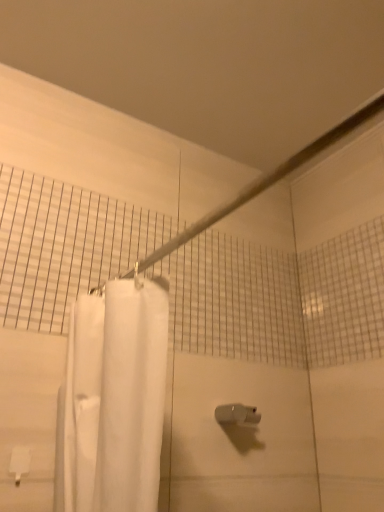
This screenshot has height=512, width=384. I want to click on satin silver towel bar at lower center, so click(x=237, y=414).

Describe the element at coordinates (237, 414) in the screenshot. I see `satin silver towel bar at lower center` at that location.

This screenshot has height=512, width=384. I want to click on satin silver towel bar at lower center, so click(x=237, y=414).